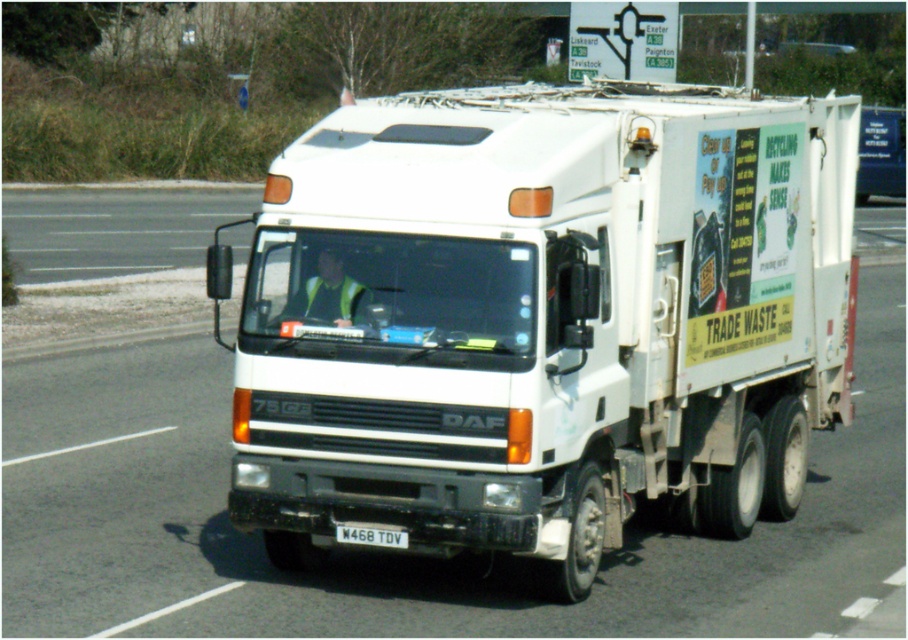
Question: Among these objects, which one is nearest to the camera?

Choices:
 (A) white plastic license plate at center
 (B) white matte truck at center

Answer: (A)

Question: Does white matte truck at center lie behind white plastic license plate at center?

Choices:
 (A) no
 (B) yes

Answer: (B)

Question: Does white matte truck at center lie in front of white plastic license plate at center?

Choices:
 (A) no
 (B) yes

Answer: (A)

Question: Does white matte truck at center lie in front of white plastic license plate at center?

Choices:
 (A) no
 (B) yes

Answer: (A)